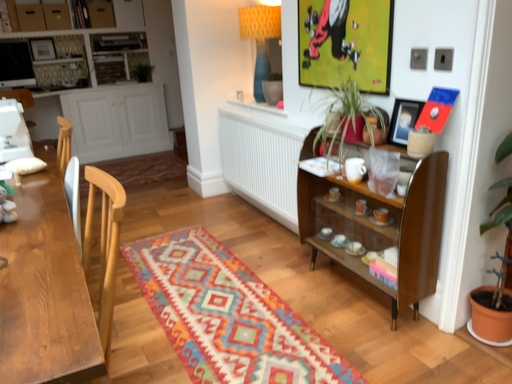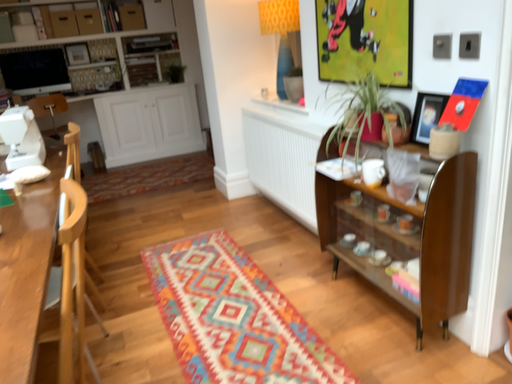
Question: Which way did the camera rotate in the video?

Choices:
 (A) rotated left
 (B) rotated right

Answer: (A)